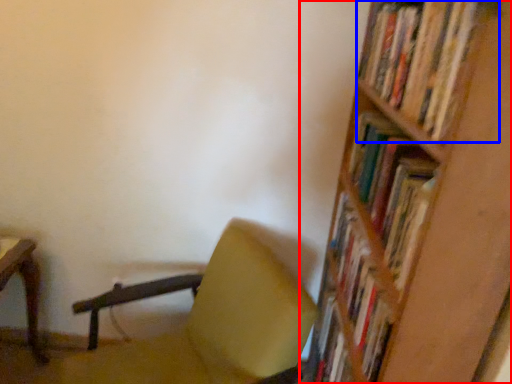
Question: Among these objects, which one is farthest to the camera, shelf (highlighted by a red box) or book (highlighted by a blue box)?

Choices:
 (A) shelf
 (B) book

Answer: (B)